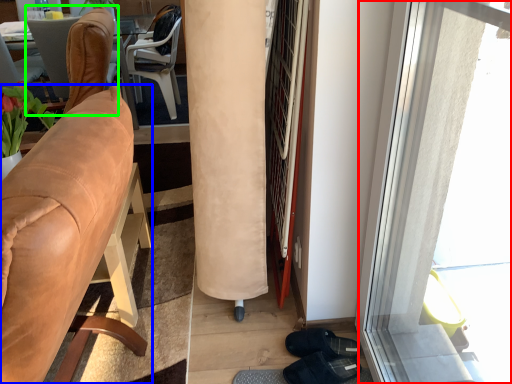
Question: Based on their relative distances, which object is farther from window (highlighted by a red box)? Choose from chair (highlighted by a blue box) and chair (highlighted by a green box).

Choices:
 (A) chair
 (B) chair

Answer: (B)